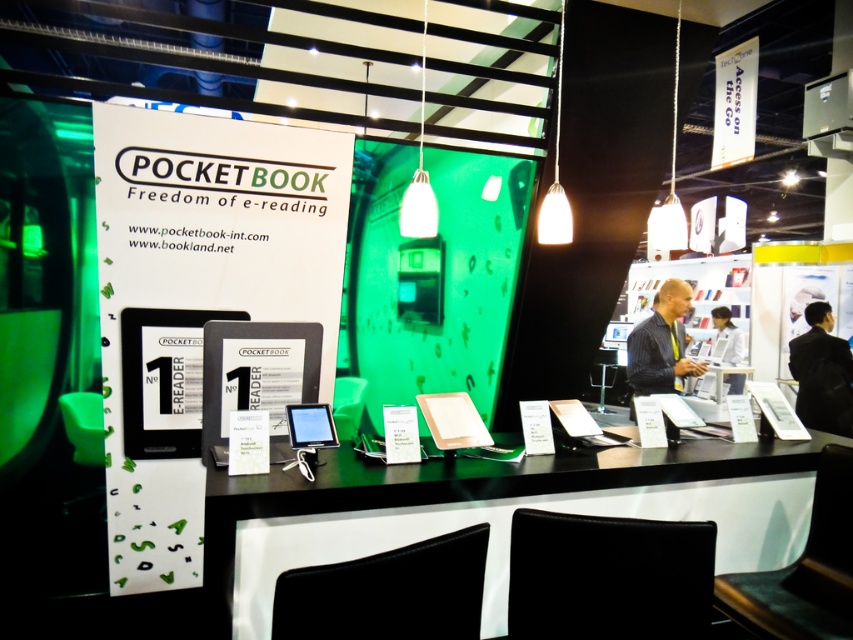
You are a customer at the PocketBook trade show booth. You see a black leather jacket at right and a white glossy laptop at center. Which object is closer to the bottom of the image?

The black leather jacket at right is positioned under the white glossy laptop at center, so it is closer to the bottom of the image.

You are a photographer at the PocketBook trade show booth. You need to take a photo of the white glossy laptop at center and the striped shirt at center. Based on their positions, which object should you focus on first to ensure both are in frame?

The striped shirt at center is located above the white glossy laptop at center, so you should focus on the striped shirt at center first to ensure both are in frame.

You are standing at the PocketBook trade show booth and see two points marked on the banner. Which point is closer to you, point (827, 419) or point (741, 380)?

A: Point (827, 419) is in front of point (741, 380), so it is closer to you.